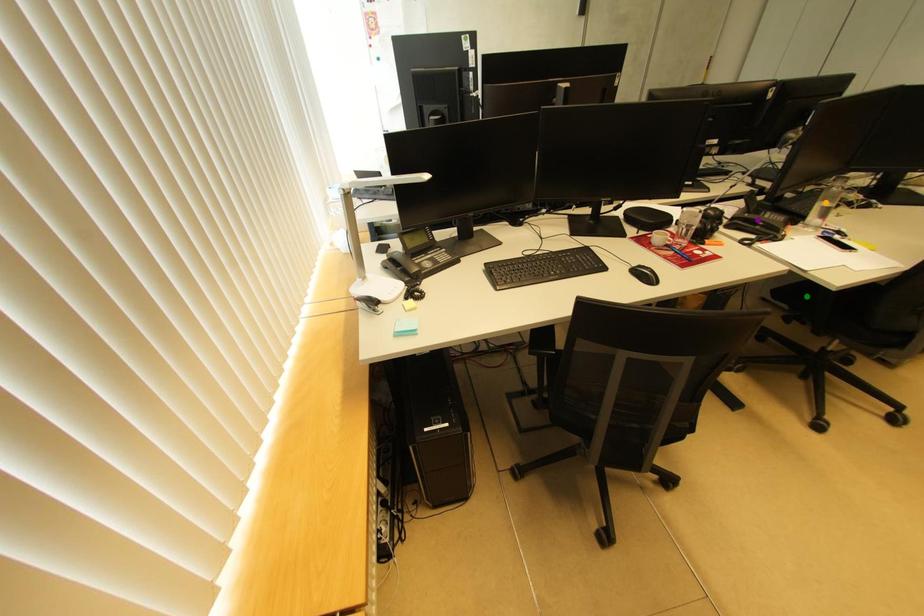
Order these from nearest to farthest:
- orange point
- purple point
- green point

orange point < green point < purple point